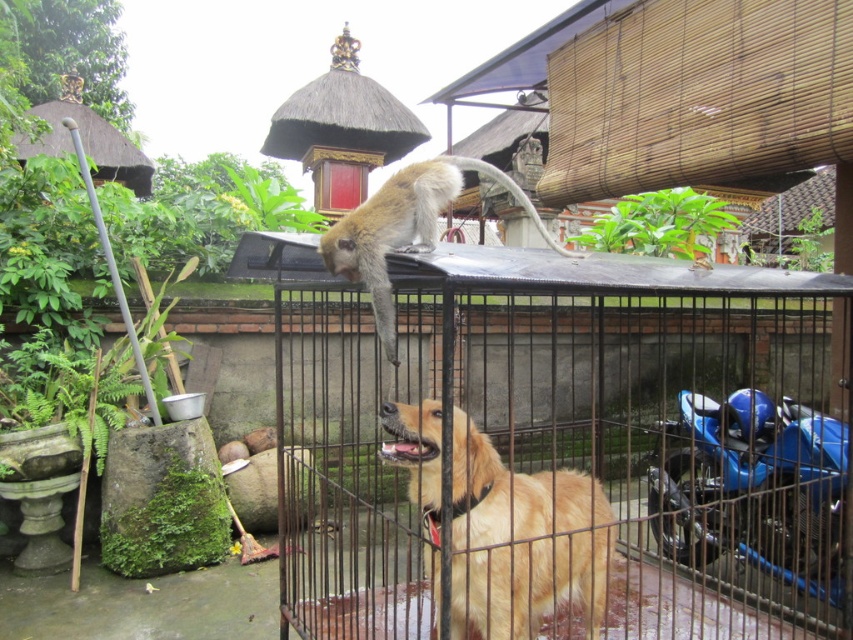
Is golden fur dog at center shorter than golden fur monkey at upper center?

Incorrect, golden fur dog at center's height does not fall short of golden fur monkey at upper center's.

Which of these two, golden fur dog at center or golden fur monkey at upper center, stands taller?

With more height is golden fur dog at center.

Which is in front, point (498, 496) or point (384, 225)?

Positioned in front is point (384, 225).

Where is `golden fur dog at center`? golden fur dog at center is located at coordinates (521, 541).

Does black metal cage at center have a lesser height compared to golden fur dog at center?

Indeed, black metal cage at center has a lesser height compared to golden fur dog at center.

Which is more to the left, black metal cage at center or golden fur dog at center?

From the viewer's perspective, golden fur dog at center appears more on the left side.

Between point (318, 317) and point (451, 451), which one is positioned in front?

Point (451, 451) is in front.

Identify the location of black metal cage at center. The width and height of the screenshot is (853, 640). pos(560,449).

Is black metal cage at center behind golden fur monkey at upper center?

Yes, it is behind golden fur monkey at upper center.

Can you confirm if black metal cage at center is positioned to the left of golden fur monkey at upper center?

Incorrect, black metal cage at center is not on the left side of golden fur monkey at upper center.

I want to click on black metal cage at center, so 560,449.

Where is `black metal cage at center`? black metal cage at center is located at coordinates (560, 449).